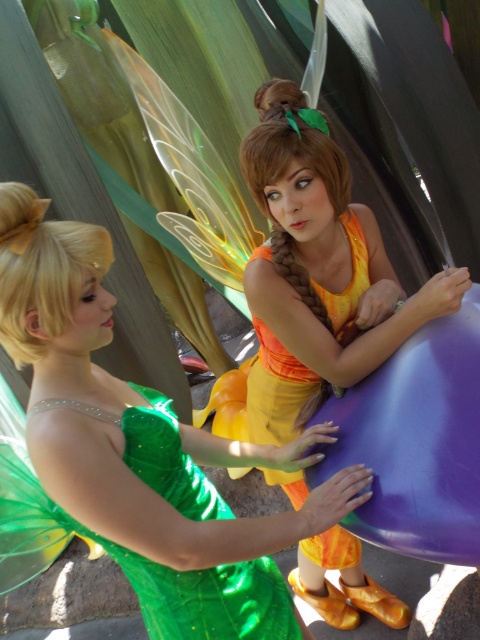
Does matte orange dress at center have a lesser width compared to green shiny dress at center?

Yes, matte orange dress at center is thinner than green shiny dress at center.

Which is behind, point (292, 432) or point (271, 560)?

The point (292, 432) is behind.

Is point (294, 177) more distant than point (126, 449)?

Yes, it is behind point (126, 449).

At what (x,y) coordinates should I click in order to perform the action: click on matte orange dress at center. Please return your answer as a coordinate pair (x, y). Looking at the image, I should click on (313, 276).

Does green satin dress at center have a greater height compared to green shiny dress at center?

Indeed, green satin dress at center has a greater height compared to green shiny dress at center.

Is point (72, 308) in front of point (156, 492)?

That is True.

Find the location of a particular element. The image size is (480, 640). green satin dress at center is located at coordinates (144, 449).

Does green satin dress at center have a larger size compared to matte orange dress at center?

No.

Is green satin dress at center shorter than matte orange dress at center?

Indeed, green satin dress at center has a lesser height compared to matte orange dress at center.

Between point (196, 545) and point (400, 609), which one is positioned in front?

Point (196, 545) is more forward.

Identify the location of green satin dress at center. The height and width of the screenshot is (640, 480). (144, 449).